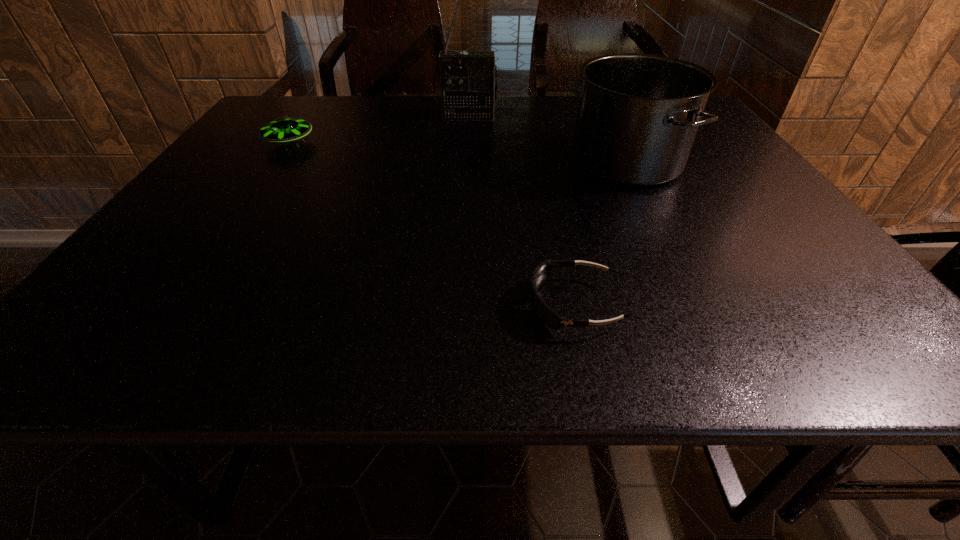
Where is `vacant space located on the front and sides of the goggles`? The width and height of the screenshot is (960, 540). vacant space located on the front and sides of the goggles is located at coordinates (x=499, y=305).

Identify the location of vacant space located 0.120m on the front and sides of the goggles. The image size is (960, 540). (458, 305).

Locate an element on the screen. The height and width of the screenshot is (540, 960). free space located 0.250m on the front and sides of the goggles is located at coordinates (380, 305).

Locate an element on the screen. object that is at the far edge is located at coordinates (468, 79).

At what (x,y) coordinates should I click in order to perform the action: click on object that is at the near edge. Please return your answer as a coordinate pair (x, y). This screenshot has width=960, height=540. Looking at the image, I should click on (546, 314).

Where is `object that is at the left edge`? object that is at the left edge is located at coordinates (283, 129).

The image size is (960, 540). I want to click on object located at the right edge, so click(x=638, y=114).

In the image, there is a desktop. Where is `vacant space at the far edge`? This screenshot has width=960, height=540. vacant space at the far edge is located at coordinates (342, 101).

The width and height of the screenshot is (960, 540). What are the coordinates of `free location at the near edge` in the screenshot? It's located at (201, 352).

The image size is (960, 540). In the image, there is a desktop. In order to click on vacant space at the left edge in this screenshot , I will do pyautogui.click(x=260, y=154).